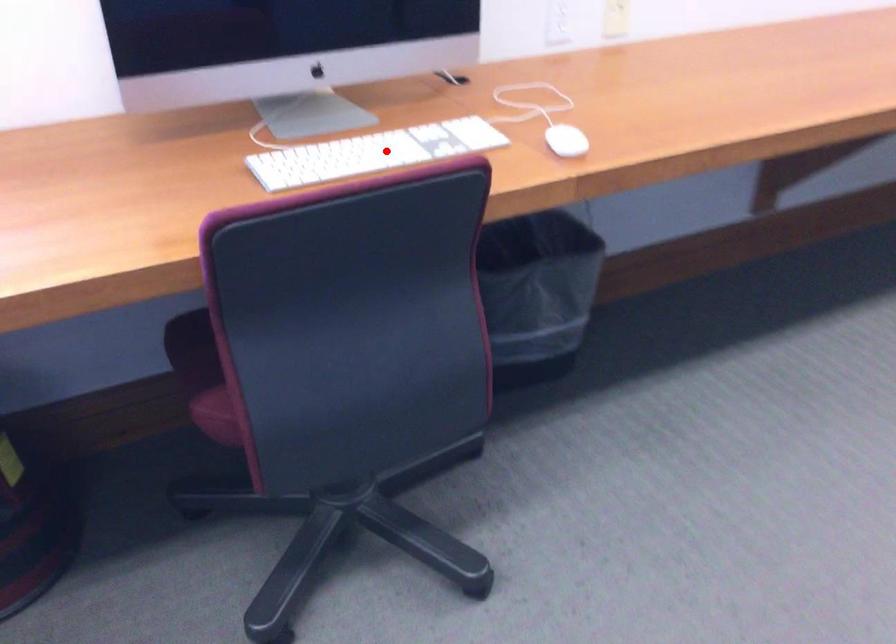
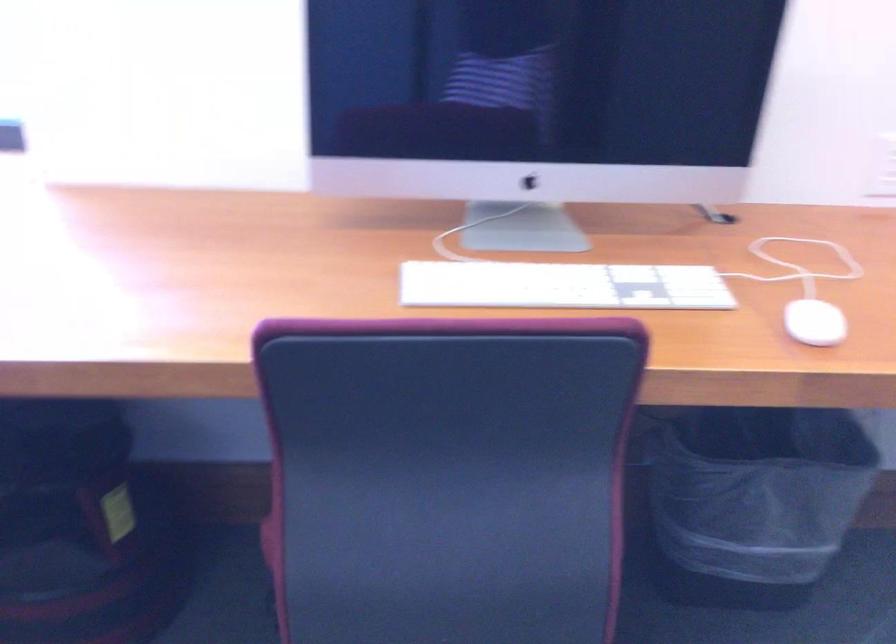
Question: I am providing you with two images of the same scene from different viewpoints. Given a red point in image1, look at the same physical point in image2. Is it:

Choices:
 (A) Closer to the viewpoint
 (B) Farther from the viewpoint

Answer: (A)